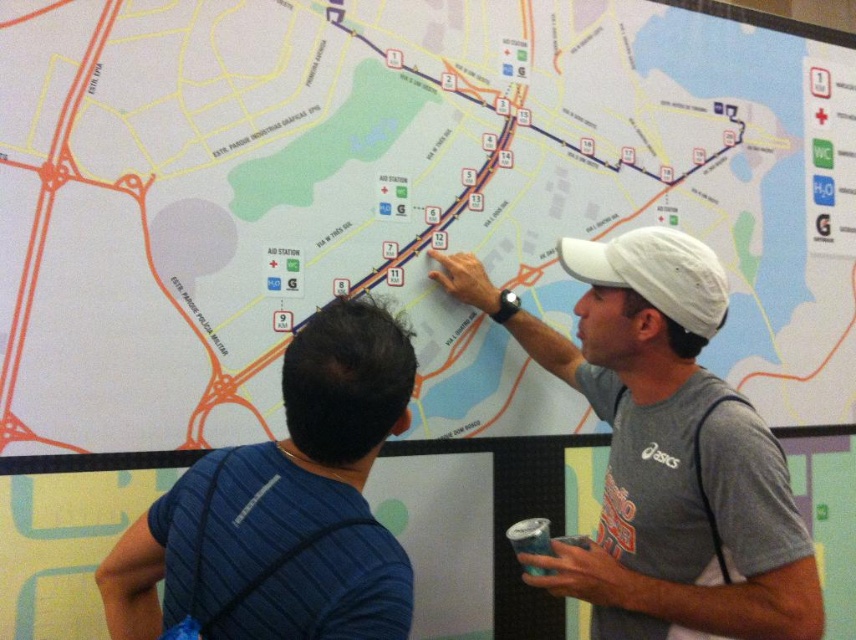
You are a photographer trying to capture both the blue striped shirt at upper left and the white matte baseball cap at upper right in a single frame. Given their sizes, which object should you focus on to ensure both are visible without cropping?

The blue striped shirt at upper left is larger in width than the white matte baseball cap at upper right. To ensure both are visible without cropping, focus on the blue striped shirt at upper left as it requires more space in the frame.

Based on the scene description, where is the blue striped shirt at upper left located in terms of coordinates?

The blue striped shirt at upper left is located at point (311, 442).